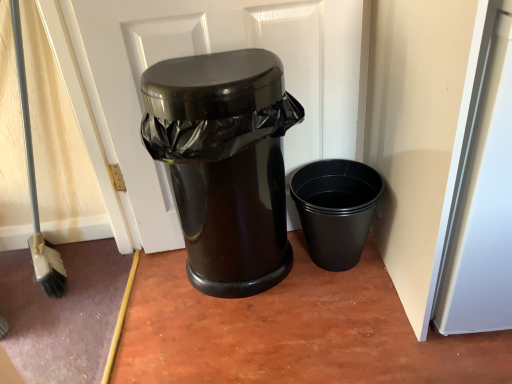
Question: From a real-world perspective, does black matte plastic cup at right, positioned as the second waste container in left-to-right order, sit lower than glossy black trash can at center?

Choices:
 (A) yes
 (B) no

Answer: (A)

Question: From the image's perspective, is black matte plastic cup at right, placed as the 1th waste container when sorted from right to left, beneath glossy black trash can at center?

Choices:
 (A) yes
 (B) no

Answer: (A)

Question: Considering the relative sizes of black matte plastic cup at right, positioned as the second waste container in left-to-right order, and glossy black trash can at center in the image provided, is black matte plastic cup at right, positioned as the second waste container in left-to-right order, bigger than glossy black trash can at center?

Choices:
 (A) yes
 (B) no

Answer: (B)

Question: Is glossy black trash can at center located within black matte plastic cup at right, positioned as the second waste container in left-to-right order?

Choices:
 (A) yes
 (B) no

Answer: (B)

Question: Does black matte plastic cup at right, placed as the 1th waste container when sorted from right to left, lie behind glossy black trash can at center?

Choices:
 (A) yes
 (B) no

Answer: (A)

Question: From their relative heights in the image, would you say glossy black trash can at center, which is the 1th waste container in left-to-right order, is taller or shorter than glossy black trash can at center?

Choices:
 (A) tall
 (B) short

Answer: (B)

Question: Considering the positions of point (228, 292) and point (159, 180), is point (228, 292) closer or farther from the camera than point (159, 180)?

Choices:
 (A) closer
 (B) farther

Answer: (A)

Question: Is glossy black trash can at center, which is the 1th waste container in left-to-right order, spatially inside glossy black trash can at center, or outside of it?

Choices:
 (A) inside
 (B) outside

Answer: (B)

Question: From the image's perspective, relative to glossy black trash can at center, is glossy black trash can at center, which ranks as the 2th waste container in right-to-left order, above or below?

Choices:
 (A) below
 (B) above

Answer: (A)

Question: From a real-world perspective, relative to black matte plastic cup at right, placed as the 1th waste container when sorted from right to left, is glossy black trash can at center vertically above or below?

Choices:
 (A) below
 (B) above

Answer: (B)

Question: From their relative heights in the image, would you say glossy black trash can at center is taller or shorter than black matte plastic cup at right, placed as the 1th waste container when sorted from right to left?

Choices:
 (A) tall
 (B) short

Answer: (A)

Question: Considering their positions, is glossy black trash can at center located in front of or behind black matte plastic cup at right, placed as the 1th waste container when sorted from right to left?

Choices:
 (A) front
 (B) behind

Answer: (A)

Question: Considering the positions of point (114, 44) and point (358, 188), is point (114, 44) closer or farther from the camera than point (358, 188)?

Choices:
 (A) farther
 (B) closer

Answer: (B)

Question: Based on their sizes in the image, would you say black matte plastic cup at right, positioned as the second waste container in left-to-right order, is bigger or smaller than glossy black trash can at center?

Choices:
 (A) big
 (B) small

Answer: (B)

Question: Is black matte plastic cup at right, placed as the 1th waste container when sorted from right to left, taller or shorter than glossy black trash can at center?

Choices:
 (A) tall
 (B) short

Answer: (B)